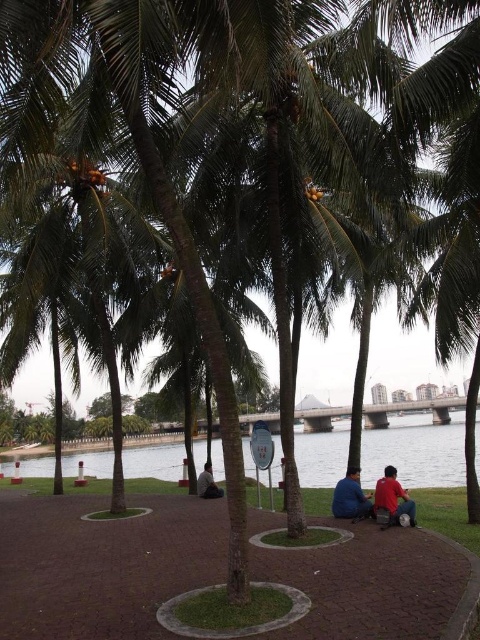
Which of these two, matte red shirt at lower right or dark gray fabric shirt at center, stands shorter?

matte red shirt at lower right is shorter.

Measure the distance between matte red shirt at lower right and camera.

matte red shirt at lower right is 8.23 meters away from camera.

Locate an element on the screen. matte red shirt at lower right is located at coordinates (393, 497).

Is matte red shirt at center smaller than matte red shirt at lower right?

No, matte red shirt at center is not smaller than matte red shirt at lower right.

Is matte red shirt at center bigger than matte red shirt at lower right?

Yes.

This screenshot has width=480, height=640. What do you see at coordinates (373, 497) in the screenshot?
I see `matte red shirt at center` at bounding box center [373, 497].

Where is `matte red shirt at center`? This screenshot has height=640, width=480. matte red shirt at center is located at coordinates 373,497.

Is matte red shirt at center to the right of dark gray fabric shirt at center from the viewer's perspective?

Yes, matte red shirt at center is to the right of dark gray fabric shirt at center.

Does matte red shirt at center have a larger size compared to dark gray fabric shirt at center?

No.

The height and width of the screenshot is (640, 480). What do you see at coordinates (373, 497) in the screenshot? I see `matte red shirt at center` at bounding box center [373, 497].

Image resolution: width=480 pixels, height=640 pixels. In order to click on matte red shirt at center in this screenshot , I will do `click(373, 497)`.